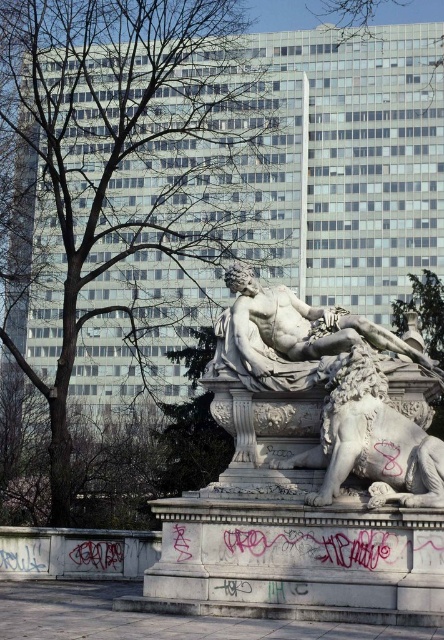
You are standing in front of the statue and want to take a photo of the lion. Which direction should you turn to face the white marble lion at lower center from the white marble statue at center?

The white marble lion at lower center is to the right of the white marble statue at center, so you should turn to your right to face it.

You are a photographer planning to take a photo of the white marble statue at center and the green leafy tree at center. Which object should you focus on first if you want to capture both in a single frame without moving the camera?

The green leafy tree at center is bigger than the white marble statue at center, so you should focus on the white marble statue at center first to ensure it is sharp and centered in the frame before adjusting the exposure for the larger tree.

You are standing in the public square and want to take a photo of the white marble statue at center with the green leafy tree at center in the background. Which side should you position yourself to ensure the tree is behind the statue?

You should position yourself to the right of the white marble statue at center so that the green leafy tree at center, which is to the left of the statue, will be visible behind it.